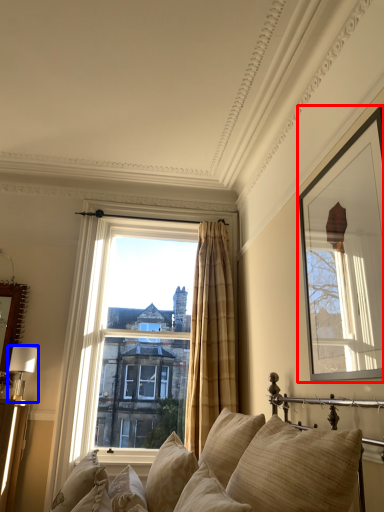
Question: Which of the following is the closest to the observer, picture frame (highlighted by a red box) or table lamp (highlighted by a blue box)?

Choices:
 (A) picture frame
 (B) table lamp

Answer: (A)